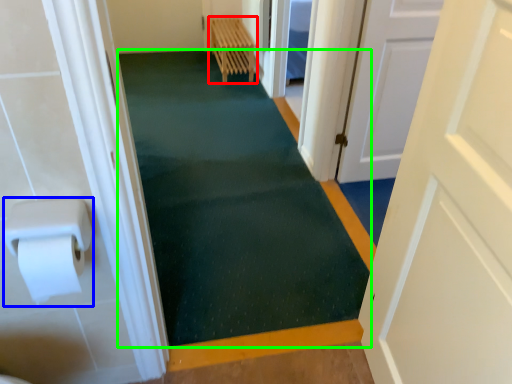
Question: Which object is positioned closest to furniture (highlighted by a red box)? Select from paper towel (highlighted by a blue box) and bath mat (highlighted by a green box).

Choices:
 (A) paper towel
 (B) bath mat

Answer: (B)